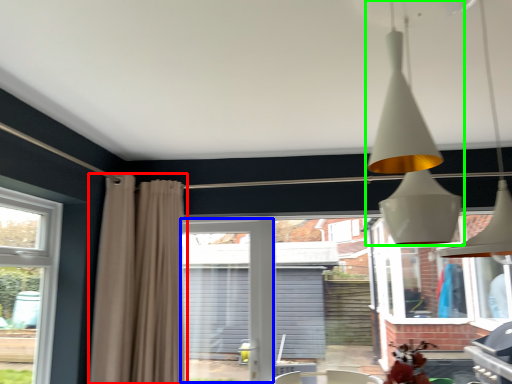
Question: Considering the real-world distances, which object is farthest from curtain (highlighted by a red box)? screen door (highlighted by a blue box) or lamp (highlighted by a green box)?

Choices:
 (A) screen door
 (B) lamp

Answer: (B)